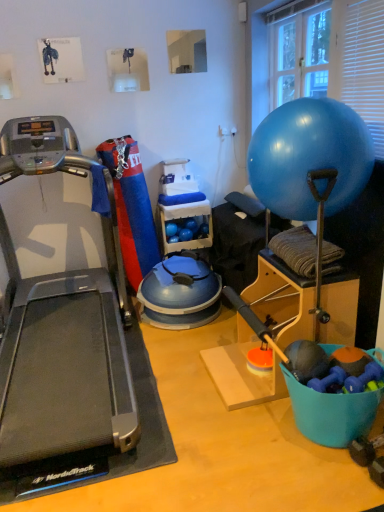
You are a GUI agent. You are given a task and a screenshot of the screen. Output one action in this format:
    pyautogui.click(x=<x>, y=<y>)
    Task: Click on the transparent glass window at upper right
    This screenshot has width=384, height=512.
    Given the screenshot: What is the action you would take?
    point(300,56)

Image resolution: width=384 pixels, height=512 pixels. Describe the element at coordinates (331, 413) in the screenshot. I see `blue plastic bucket at lower right` at that location.

Measure the distance between point (348, 414) and camera.

Point (348, 414) is 1.82 meters from camera.

Describe the element at coordinates (310, 158) in the screenshot. Image resolution: width=384 pixels, height=512 pixels. I see `blue rubber ball at upper right` at that location.

Measure the distance between point (270, 189) and camera.

6.56 feet.

Image resolution: width=384 pixels, height=512 pixels. In order to click on blue rubber ball at center in this screenshot , I will do `click(183, 222)`.

In terms of width, does transparent glass window at upper right look wider or thinner when compared to blue plastic bucket at lower right?

Clearly, transparent glass window at upper right has less width compared to blue plastic bucket at lower right.

Is transparent glass window at upper right bigger than blue plastic bucket at lower right?

Correct, transparent glass window at upper right is larger in size than blue plastic bucket at lower right.

Could blue plastic bucket at lower right be considered to be inside transparent glass window at upper right?

Actually, blue plastic bucket at lower right is outside transparent glass window at upper right.

From the image's perspective, which is above, transparent glass window at upper right or blue plastic bucket at lower right?

transparent glass window at upper right appears higher in the image.

Considering the relative sizes of blue rubber ball at upper right and blue plastic bucket at lower right in the image provided, is blue rubber ball at upper right thinner than blue plastic bucket at lower right?

No.

Consider the image. Which is less distant, (314, 155) or (303, 392)?

Point (303, 392)

Which is correct: blue rubber ball at upper right is inside blue plastic bucket at lower right, or outside of it?

blue rubber ball at upper right is outside blue plastic bucket at lower right.

Could you tell me if silver/black treadmill at left is facing transparent glass window at upper right?

No, silver/black treadmill at left is not aimed at transparent glass window at upper right.

Is silver/black treadmill at left closer to camera compared to transparent glass window at upper right?

Yes, silver/black treadmill at left is closer to the camera.

Which is behind, point (95, 176) or point (277, 97)?

The point (277, 97) is farther.

Would you say silver/black treadmill at left is outside transparent glass window at upper right?

Yes, silver/black treadmill at left is not within transparent glass window at upper right.

Considering the sizes of silver/black treadmill at left and blue rubber ball at upper right in the image, is silver/black treadmill at left wider or thinner than blue rubber ball at upper right?

Considering their sizes, silver/black treadmill at left looks broader than blue rubber ball at upper right.

Measure the distance from silver/black treadmill at left to blue rubber ball at upper right.

1.42 meters.

Is silver/black treadmill at left in front of or behind blue rubber ball at upper right in the image?

silver/black treadmill at left is positioned closer to the viewer than blue rubber ball at upper right.

From the image's perspective, would you say silver/black treadmill at left is shown under blue rubber ball at upper right?

Indeed, from the image's perspective, silver/black treadmill at left is shown beneath blue rubber ball at upper right.

Is blue plastic bucket at lower right oriented away from blue rubber ball at upper right?

No.

Considering the positions of objects blue plastic bucket at lower right and blue rubber ball at upper right in the image provided, who is behind, blue plastic bucket at lower right or blue rubber ball at upper right?

blue rubber ball at upper right is further from the camera.

From a real-world perspective, between blue plastic bucket at lower right and blue rubber ball at upper right, who is vertically lower?

In real-world perspective, blue plastic bucket at lower right is lower.

Who is smaller, blue plastic bucket at lower right or blue rubber ball at upper right?

With smaller size is blue plastic bucket at lower right.

Does point (320, 45) lie behind point (11, 386)?

That is True.

Is there a large distance between transparent glass window at upper right and silver/black treadmill at left?

transparent glass window at upper right is far away from silver/black treadmill at left.

Is transparent glass window at upper right to the left of silver/black treadmill at left from the viewer's perspective?

No.

From the image's perspective, is transparent glass window at upper right located above or below silver/black treadmill at left?

From the image's perspective, transparent glass window at upper right appears above silver/black treadmill at left.

Is transparent glass window at upper right not close to blue rubber ball at center?

Yes.

Locate an element on the screen. window screen in front of the blue rubber ball at center is located at coordinates (300, 56).

Which object is wider, transparent glass window at upper right or blue rubber ball at center?

Wider between the two is blue rubber ball at center.

Based on the photo, does transparent glass window at upper right have a larger size compared to blue rubber ball at center?

Yes.

The image size is (384, 512). What are the coordinates of `window screen located on the right of blue plastic bucket at lower right` in the screenshot? It's located at (300, 56).

Locate an element on the screen. ball on the left of blue plastic bucket at lower right is located at coordinates (310, 158).

Considering their positions, is blue rubber ball at center positioned further to blue rubber ball at upper right than silver/black treadmill at left?

blue rubber ball at center.

Considering their positions, is blue plastic bucket at lower right positioned further to silver/black treadmill at left than transparent glass window at upper right?

transparent glass window at upper right lies further to silver/black treadmill at left than the other object.

When comparing their distances from transparent glass window at upper right, does silver/black treadmill at left or blue rubber ball at center seem closer?

blue rubber ball at center.

Consider the image. When comparing their distances from silver/black treadmill at left, does blue rubber ball at center or blue rubber ball at upper right seem closer?

blue rubber ball at center lies closer to silver/black treadmill at left than the other object.

When comparing their distances from transparent glass window at upper right, does blue plastic bucket at lower right or blue rubber ball at center seem closer?

Among the two, blue rubber ball at center is located nearer to transparent glass window at upper right.

From the image, which object appears to be nearer to blue rubber ball at center, blue rubber ball at upper right or transparent glass window at upper right?

Result: The object closer to blue rubber ball at center is transparent glass window at upper right.

Consider the image. Estimate the real-world distances between objects in this image. Which object is further from blue plastic bucket at lower right, blue rubber ball at center or silver/black treadmill at left?

The object further to blue plastic bucket at lower right is blue rubber ball at center.

When comparing their distances from blue plastic bucket at lower right, does blue rubber ball at center or transparent glass window at upper right seem closer?

blue rubber ball at center is positioned closer to the anchor blue plastic bucket at lower right.

This screenshot has width=384, height=512. What are the coordinates of `window screen positioned between silver/black treadmill at left and blue rubber ball at center from near to far` in the screenshot? It's located at (300, 56).

At what (x,y) coordinates should I click in order to perform the action: click on ball between blue plastic bucket at lower right and blue rubber ball at center along the z-axis. Please return your answer as a coordinate pair (x, y). Looking at the image, I should click on (310, 158).

The image size is (384, 512). Identify the location of ball located between silver/black treadmill at left and blue plastic bucket at lower right in the left-right direction. tap(310, 158).

Image resolution: width=384 pixels, height=512 pixels. In order to click on window screen between blue rubber ball at upper right and blue rubber ball at center from front to back in this screenshot , I will do `click(300, 56)`.